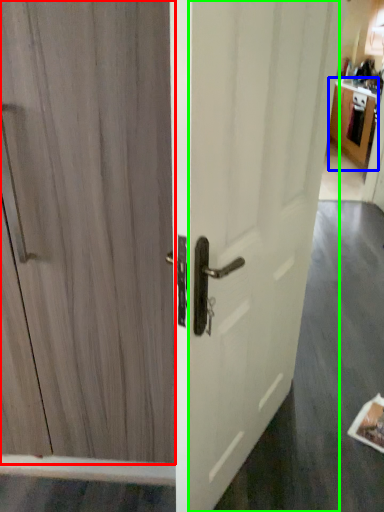
Question: Estimate the real-world distances between objects in this image. Which object is closer to door (highlighted by a red box), cabinetry (highlighted by a blue box) or screen door (highlighted by a green box)?

Choices:
 (A) cabinetry
 (B) screen door

Answer: (B)